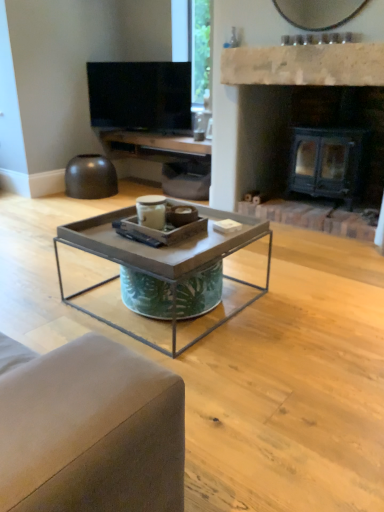
Where is `free space to the left of metal/texturedcoffee table at center`? free space to the left of metal/texturedcoffee table at center is located at coordinates (55, 288).